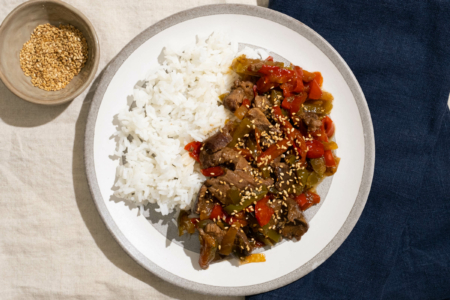
This screenshot has width=450, height=300. What are the coordinates of `bowl` in the screenshot? It's located at (14, 67).